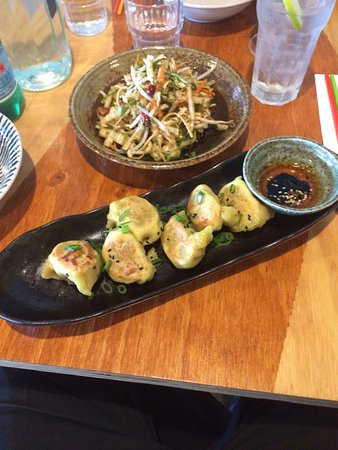
You are a GUI agent. You are given a task and a screenshot of the screen. Output one action in this format:
    pyautogui.click(x=<x>, y=<y>)
    Task: Click on the sauce in small aluminum bowl used to dip dumplings in
    The height and width of the screenshot is (450, 338).
    Given the screenshot: What is the action you would take?
    pyautogui.click(x=294, y=188)